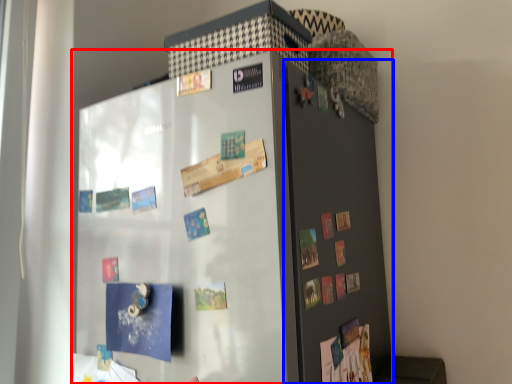
Question: Which object appears farthest to the camera in this image, refrigerator (highlighted by a red box) or door (highlighted by a blue box)?

Choices:
 (A) refrigerator
 (B) door

Answer: (B)